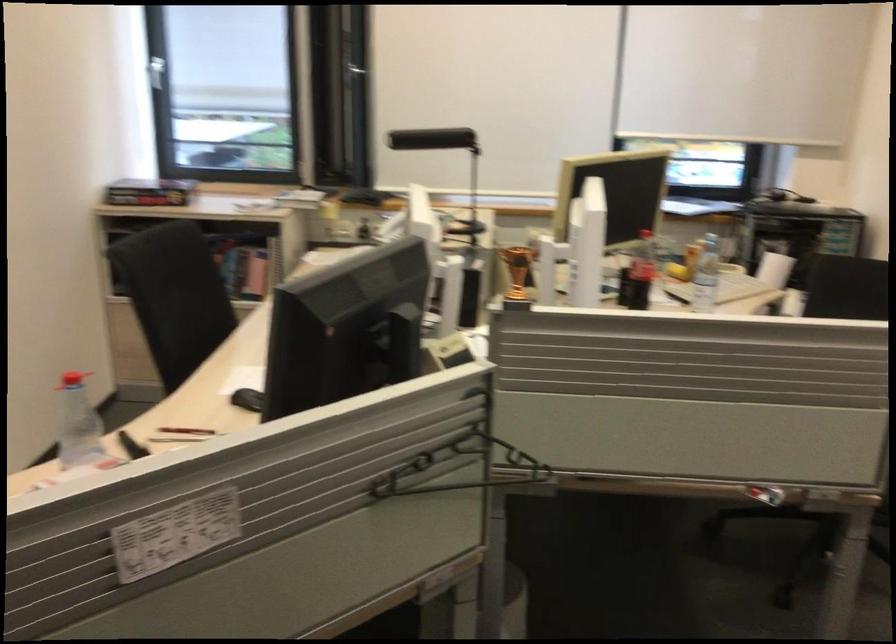
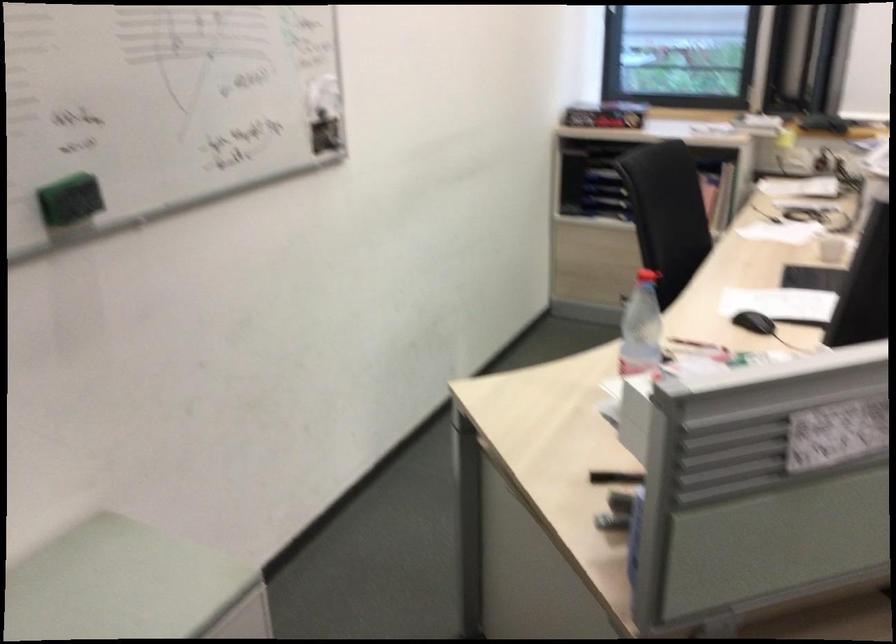
Question: The camera is either moving clockwise (left) or counter-clockwise (right) around the object. The first image is from the beginning of the video and the second image is from the end. Is the camera moving left or right when shooting the video?

Choices:
 (A) Left
 (B) Right

Answer: (B)